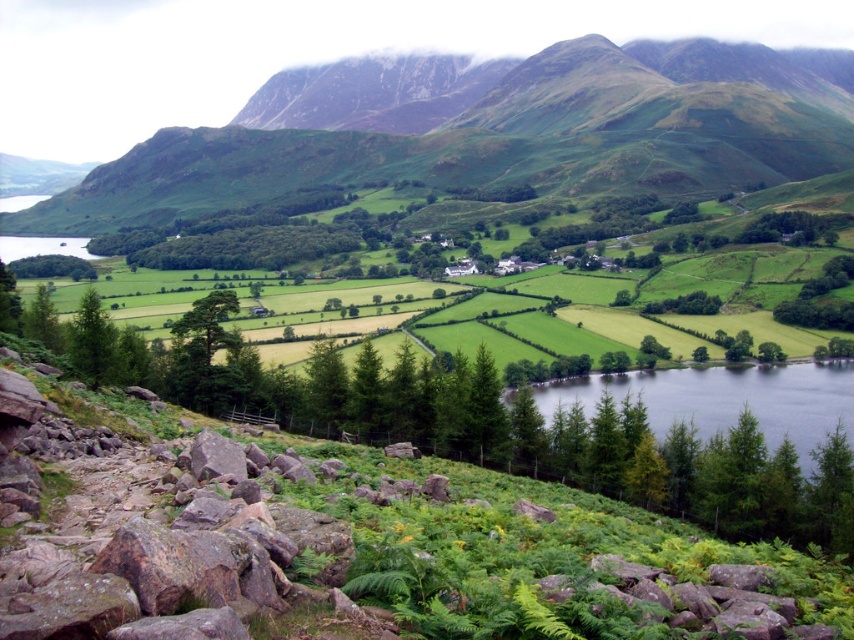
Question: Considering the relative positions of green grassy water at lower center and green leafy tree at lower left in the image provided, where is green grassy water at lower center located with respect to green leafy tree at lower left?

Choices:
 (A) below
 (B) above

Answer: (A)

Question: Among these objects, which one is nearest to the camera?

Choices:
 (A) green leafy tree at lower left
 (B) green grassy water at lower center
 (C) green grassy mountain at upper center

Answer: (B)

Question: Where is green grassy water at lower center located in relation to green leafy tree at lower left in the image?

Choices:
 (A) left
 (B) right

Answer: (B)

Question: Among these points, which one is nearest to the camera?

Choices:
 (A) (16, 272)
 (B) (712, 372)
 (C) (623, 136)

Answer: (B)

Question: Which is nearer to the green leafy tree at lower left?

Choices:
 (A) green grassy mountain at upper center
 (B) green grassy water at lower center

Answer: (A)

Question: Can you confirm if green grassy mountain at upper center is smaller than green leafy tree at lower left?

Choices:
 (A) yes
 (B) no

Answer: (B)